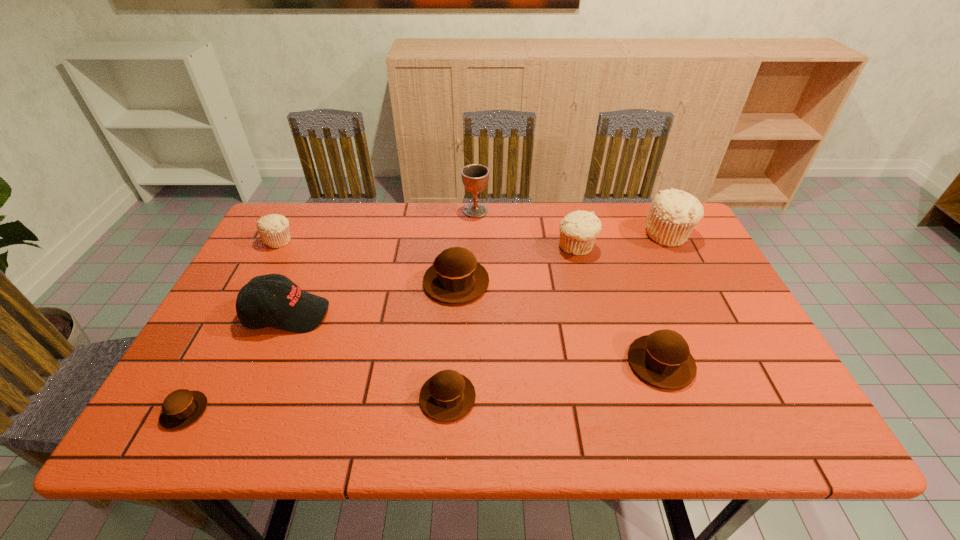
Where is `vacant space at the near edge`? vacant space at the near edge is located at coordinates (267, 418).

The height and width of the screenshot is (540, 960). What are the coordinates of `free space at the left edge` in the screenshot? It's located at (237, 337).

In the image, there is a desktop. Where is `vacant space at the right edge`? Image resolution: width=960 pixels, height=540 pixels. vacant space at the right edge is located at coordinates [x=773, y=380].

Image resolution: width=960 pixels, height=540 pixels. Find the location of `free spot between the chalice and the second biggest beige muffin`. free spot between the chalice and the second biggest beige muffin is located at coordinates (526, 229).

Image resolution: width=960 pixels, height=540 pixels. What are the coordinates of `unoccupied position between the fourth nearest muffin and the rightmost brown muffin` in the screenshot? It's located at tap(559, 322).

At what (x,y) coordinates should I click in order to perform the action: click on vacant space that is in between the fourth nearest muffin and the brown chalice. Please return your answer as a coordinate pair (x, y). The height and width of the screenshot is (540, 960). Looking at the image, I should click on (466, 246).

At what (x,y) coordinates should I click in order to perform the action: click on vacant space that is in between the smallest beige muffin and the second biggest beige muffin. Please return your answer as a coordinate pair (x, y). This screenshot has height=540, width=960. Looking at the image, I should click on (428, 244).

Identify the location of vacant region between the leftmost beige muffin and the second beige muffin from right to left. pyautogui.click(x=428, y=244).

You are a GUI agent. You are given a task and a screenshot of the screen. Output one action in this format:
    pyautogui.click(x=<x>, y=<y>)
    Task: Click on the free space between the second shortest muffin and the second biggest brown muffin
    
    Given the screenshot: What is the action you would take?
    pyautogui.click(x=554, y=380)

Locate an element on the screen. The image size is (960, 540). blank region between the rightmost object and the smallest brown muffin is located at coordinates (426, 322).